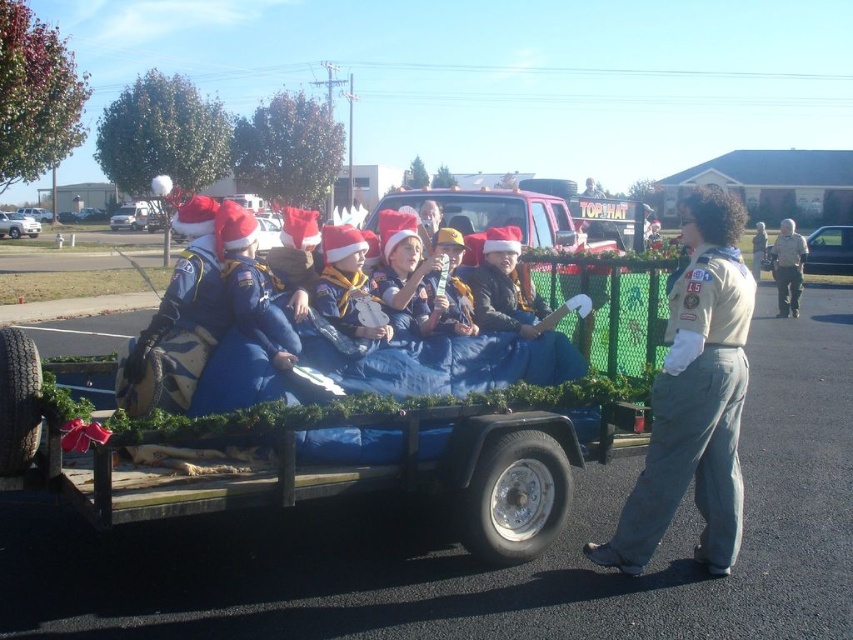
You are a photographer standing at the back of the trailer. You need to take a photo of both the tan uniform at center and the gray uniform at right. Can you see both uniforms clearly in your shot?

The tan uniform at center is in front of the gray uniform at right, so the photographer might have difficulty seeing the gray uniform at right clearly if the tan uniform at center is blocking it.

Consider the image. You are a photographer at the parade. You need to take a photo that includes both the tan uniform at center and the gray uniform at right. Which uniform should you position closer to the camera to ensure both are visible clearly?

The tan uniform at center is smaller than the gray uniform at right, so positioning the tan uniform at center closer to the camera will help both appear clearer in the photo.